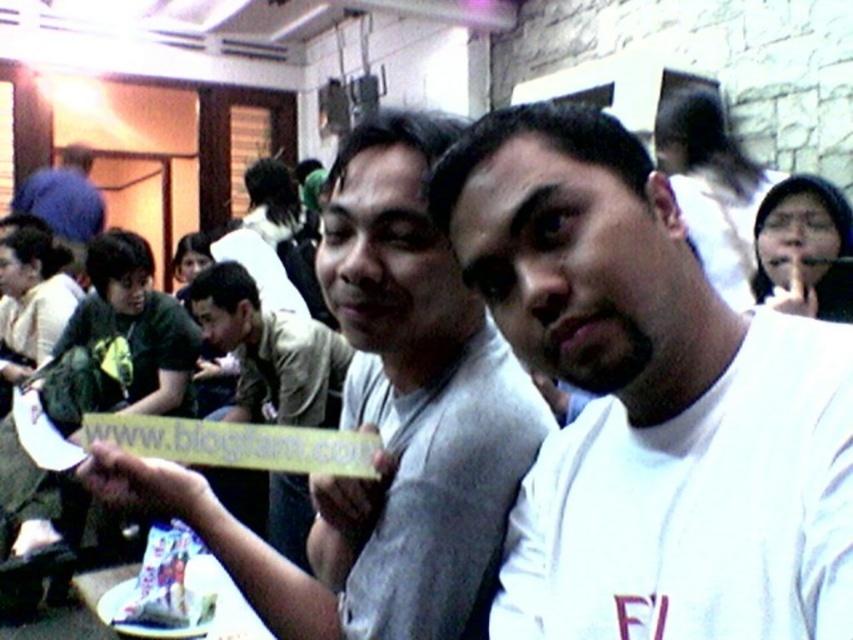
You are a photographer adjusting your camera settings to capture the scene. The gray fabric shirt at center and the smooth skin face at upper right are both in your frame. Based on their positions, which object would require you to focus your lens closer to the camera?

The smooth skin face at upper right requires focusing closer to the camera because it is smaller in height compared to the gray fabric shirt at center, indicating it might be farther away.

You are a photographer trying to capture the white matte shirt at center and the white paper plate at lower center in a single shot. Since both are white, you want to ensure they are distinguishable. Based on their positions, which object is closer to the camera?

The white matte shirt at center is positioned over the white paper plate at lower center, meaning it is closer to the camera.